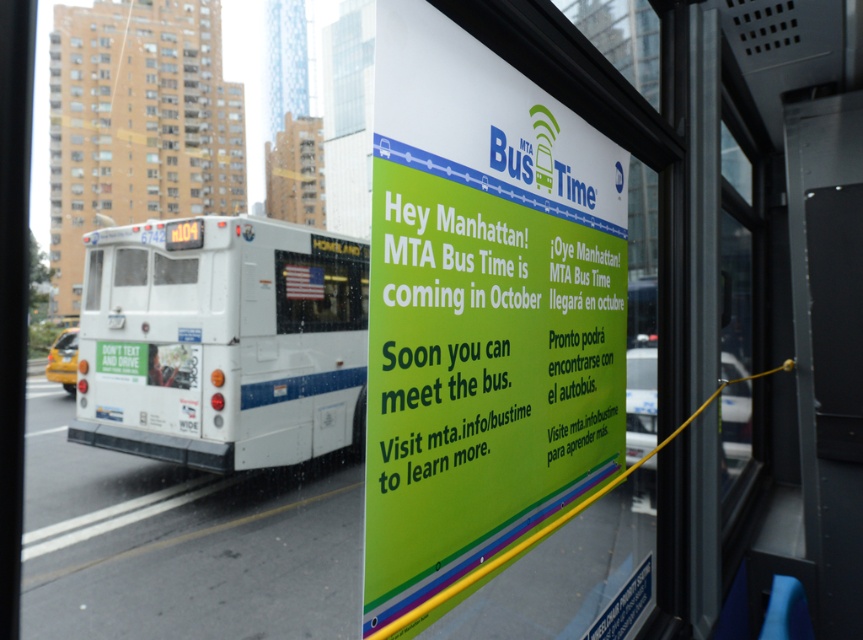
You are a pedestrian standing at the bus stop and see the white matte bus at upper left approaching. The camera is mounted on a pole 1.5 meters above the ground. If the bus is moving at 15 km per hour, how many seconds until the bus reaches the camera?

The distance between the white matte bus at upper left and the camera is 27.27 meters. Converting the bus speed from 15 km per hour to meters per second gives approximately 4.17 m per second. Dividing the distance by speed, 27.27 meters divided by 4.17 m per second equals approximately 6.54 seconds. So the bus will reach the camera in about 6.5 seconds.

You are standing inside the bus near the window where the promotional poster is displayed. You notice a specific point marked at coordinates point (x=526, y=412). If you want to take a photo of this point with your phone camera, which is 1.5 feet wide, will the camera be able to capture the entire point in the frame without moving closer?

The point (x=526, y=412) is 5.65 feet away from the camera. Since the camera is 1.5 feet wide, the distance is sufficient to capture the entire point in the frame without needing to move closer.

You are a passenger sitting on the bus and looking through the window. You see the white glossy bus at left and the reflective glass american flag at center. Which object is closer to your left side?

The white glossy bus at left is closer to your left side because it is positioned to the left of the reflective glass american flag at center.